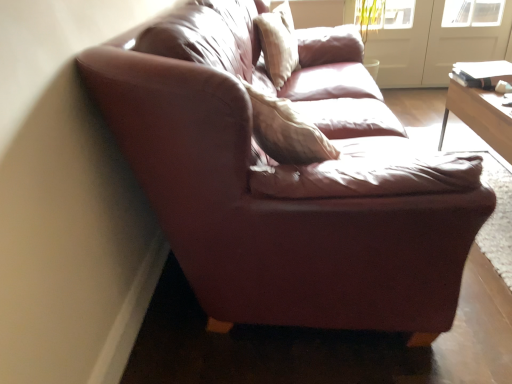
Describe the element at coordinates (278, 43) in the screenshot. I see `light beige fabric pillow at upper center` at that location.

Describe the element at coordinates (462, 44) in the screenshot. The width and height of the screenshot is (512, 384). I see `transparent glass screen door at upper right, which appears as the 1th screen door when viewed from the right` at that location.

Identify the location of light beige fabric pillow at upper center. The width and height of the screenshot is (512, 384). (278, 43).

Is white glossy screen door at upper right, arranged as the 1th screen door when viewed from the left, positioned in front of light beige fabric pillow at upper center?

No.

Is white glossy screen door at upper right, the second screen door viewed from the right, positioned far away from light beige fabric pillow at upper center?

Absolutely, white glossy screen door at upper right, the second screen door viewed from the right, is distant from light beige fabric pillow at upper center.

Based on the photo, can you confirm if white glossy screen door at upper right, the second screen door viewed from the right, is positioned to the right of light beige fabric pillow at upper center?

Yes, white glossy screen door at upper right, the second screen door viewed from the right, is to the right of light beige fabric pillow at upper center.

From a real-world perspective, starting from the light beige fabric pillow at upper center, which screen door is the 1st one below it? Please provide its 2D coordinates.

[(401, 50)]

Is light beige fabric pillow at upper center looking in the opposite direction of transparent glass screen door at upper right, which appears as the 1th screen door when viewed from the right?

That's not correct — light beige fabric pillow at upper center is not looking away from transparent glass screen door at upper right, which appears as the 1th screen door when viewed from the right.

Which object is positioned more to the left, light beige fabric pillow at upper center or transparent glass screen door at upper right, which appears as the 1th screen door when viewed from the right?

From the viewer's perspective, light beige fabric pillow at upper center appears more on the left side.

From a real-world perspective, which object rests below the other?

From a 3D spatial view, transparent glass screen door at upper right, which appears as the 1th screen door when viewed from the right, is below.

Identify the location of the 1st screen door above the light beige fabric pillow at upper center (from the image's perspective). click(x=462, y=44).

From the image's perspective, who appears lower, light beige fabric pillow at upper center or white glossy screen door at upper right, arranged as the 1th screen door when viewed from the left?

light beige fabric pillow at upper center, from the image's perspective.

Measure the distance from light beige fabric pillow at upper center to white glossy screen door at upper right, arranged as the 1th screen door when viewed from the left.

The distance of light beige fabric pillow at upper center from white glossy screen door at upper right, arranged as the 1th screen door when viewed from the left, is 1.55 meters.

How many degrees apart are the facing directions of light beige fabric pillow at upper center and white glossy screen door at upper right, the second screen door viewed from the right?

74.6 degrees.

From a real-world perspective, is light beige fabric pillow at upper center below white glossy screen door at upper right, the second screen door viewed from the right?

No, from a real-world perspective, light beige fabric pillow at upper center is not beneath white glossy screen door at upper right, the second screen door viewed from the right.

Is transparent glass screen door at upper right, which is the second screen door from left to right, behind light beige fabric pillow at upper center?

Yes.

Which of these two, transparent glass screen door at upper right, which appears as the 1th screen door when viewed from the right, or light beige fabric pillow at upper center, stands taller?

With more height is transparent glass screen door at upper right, which appears as the 1th screen door when viewed from the right.

From a real-world perspective, which object rests below the other?

From a 3D spatial view, transparent glass screen door at upper right, which is the second screen door from left to right, is below.

Is transparent glass screen door at upper right, which appears as the 1th screen door when viewed from the right, looking in the opposite direction of white glossy screen door at upper right, arranged as the 1th screen door when viewed from the left?

transparent glass screen door at upper right, which appears as the 1th screen door when viewed from the right, does not have its back to white glossy screen door at upper right, arranged as the 1th screen door when viewed from the left.

Between transparent glass screen door at upper right, which appears as the 1th screen door when viewed from the right, and white glossy screen door at upper right, arranged as the 1th screen door when viewed from the left, which one appears on the left side from the viewer's perspective?

Positioned to the left is white glossy screen door at upper right, arranged as the 1th screen door when viewed from the left.

How much distance is there between transparent glass screen door at upper right, which appears as the 1th screen door when viewed from the right, and white glossy screen door at upper right, the second screen door viewed from the right?

A distance of 9.75 inches exists between transparent glass screen door at upper right, which appears as the 1th screen door when viewed from the right, and white glossy screen door at upper right, the second screen door viewed from the right.

Is white glossy screen door at upper right, arranged as the 1th screen door when viewed from the left, completely or partially inside transparent glass screen door at upper right, which is the second screen door from left to right?

That's incorrect, white glossy screen door at upper right, arranged as the 1th screen door when viewed from the left, is not inside transparent glass screen door at upper right, which is the second screen door from left to right.

Is white glossy screen door at upper right, the second screen door viewed from the right, positioned behind transparent glass screen door at upper right, which appears as the 1th screen door when viewed from the right?

Yes, it is.

From the picture: Considering the relative positions of white glossy screen door at upper right, arranged as the 1th screen door when viewed from the left, and transparent glass screen door at upper right, which is the second screen door from left to right, in the image provided, is white glossy screen door at upper right, arranged as the 1th screen door when viewed from the left, to the left or to the right of transparent glass screen door at upper right, which is the second screen door from left to right,?

white glossy screen door at upper right, arranged as the 1th screen door when viewed from the left, is positioned on transparent glass screen door at upper right, which is the second screen door from left to right,'s left side.

At what (x,y) coordinates should I click in order to perform the action: click on screen door above the transparent glass screen door at upper right, which is the second screen door from left to right (from a real-world perspective). Please return your answer as a coordinate pair (x, y). This screenshot has height=384, width=512. Looking at the image, I should click on (401, 50).

Considering the positions of points (419, 60) and (501, 27), is point (419, 60) farther from camera compared to point (501, 27)?

Yes, it is.

Locate an element on the screen. This screenshot has height=384, width=512. the 1st screen door to the right of the light beige fabric pillow at upper center, counting from the anchor's position is located at coordinates (401, 50).

This screenshot has height=384, width=512. Identify the location of pillow on the left of transparent glass screen door at upper right, which is the second screen door from left to right. (278, 43).

When comparing their distances from transparent glass screen door at upper right, which appears as the 1th screen door when viewed from the right, does light beige fabric pillow at upper center or white glossy screen door at upper right, the second screen door viewed from the right, seem further?

light beige fabric pillow at upper center lies further to transparent glass screen door at upper right, which appears as the 1th screen door when viewed from the right, than the other object.

Based on their spatial positions, is white glossy screen door at upper right, arranged as the 1th screen door when viewed from the left, or transparent glass screen door at upper right, which is the second screen door from left to right, further from light beige fabric pillow at upper center?

transparent glass screen door at upper right, which is the second screen door from left to right, is positioned further to the anchor light beige fabric pillow at upper center.

In the scene shown: Based on their spatial positions, is transparent glass screen door at upper right, which is the second screen door from left to right, or white glossy screen door at upper right, the second screen door viewed from the right, closer to light beige fabric pillow at upper center?

Based on the image, white glossy screen door at upper right, the second screen door viewed from the right, appears to be nearer to light beige fabric pillow at upper center.

Which object lies nearer to the anchor point white glossy screen door at upper right, the second screen door viewed from the right, transparent glass screen door at upper right, which appears as the 1th screen door when viewed from the right, or light beige fabric pillow at upper center?

Based on the image, transparent glass screen door at upper right, which appears as the 1th screen door when viewed from the right, appears to be nearer to white glossy screen door at upper right, the second screen door viewed from the right.

Which object lies further to the anchor point transparent glass screen door at upper right, which is the second screen door from left to right, white glossy screen door at upper right, the second screen door viewed from the right, or light beige fabric pillow at upper center?

The object further to transparent glass screen door at upper right, which is the second screen door from left to right, is light beige fabric pillow at upper center.

Estimate the real-world distances between objects in this image. Which object is further from white glossy screen door at upper right, the second screen door viewed from the right, light beige fabric pillow at upper center or transparent glass screen door at upper right, which appears as the 1th screen door when viewed from the right?

The object further to white glossy screen door at upper right, the second screen door viewed from the right, is light beige fabric pillow at upper center.

The image size is (512, 384). Find the location of `screen door between light beige fabric pillow at upper center and transparent glass screen door at upper right, which is the second screen door from left to right, from left to right`. screen door between light beige fabric pillow at upper center and transparent glass screen door at upper right, which is the second screen door from left to right, from left to right is located at coordinates (401, 50).